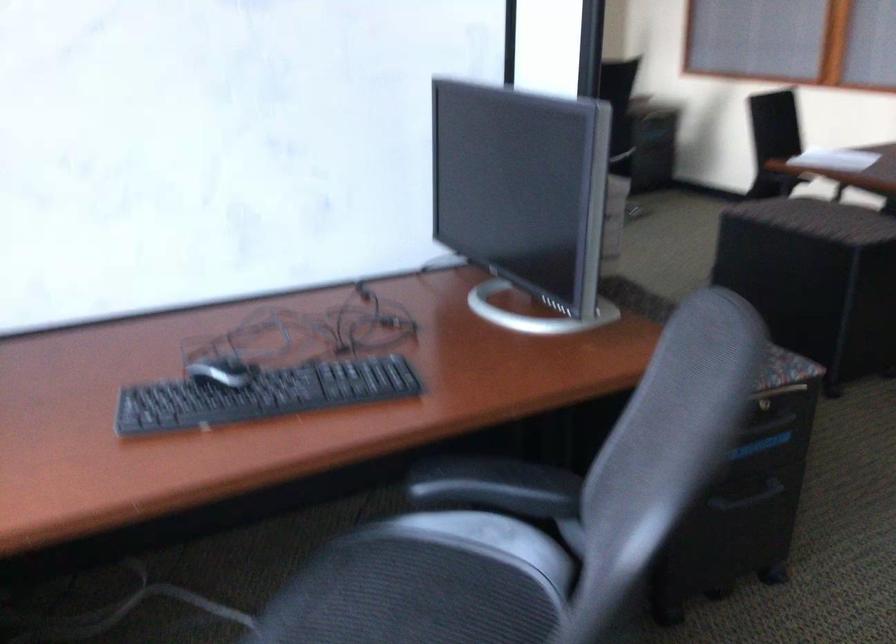
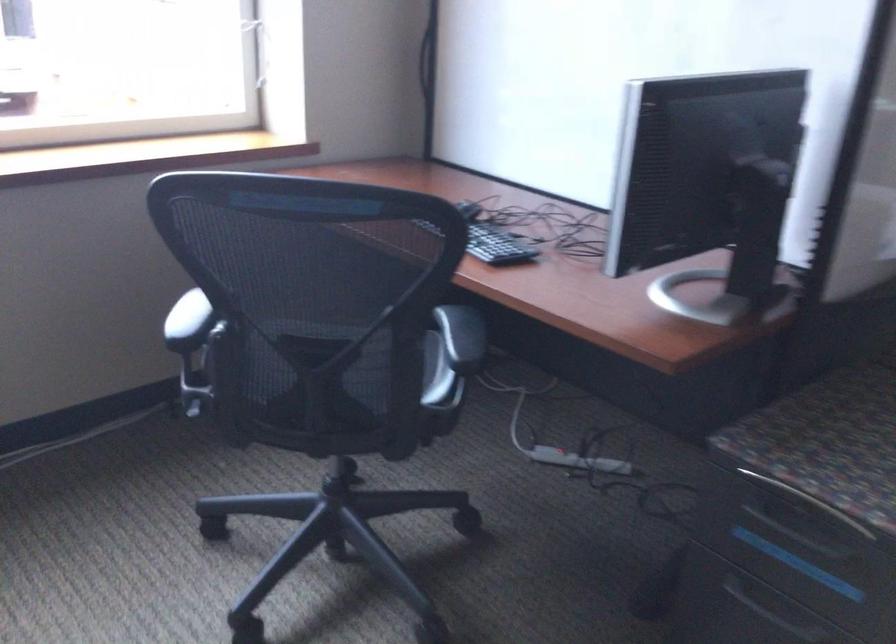
Question: I am providing you with two images of the same scene from different viewpoints. After the viewpoint changes to image2, which objects are now occluded?

Choices:
 (A) power strip switch
 (B) recessed drawer handle
 (C) computer mouse
 (D) pump bottle dispenser

Answer: (C)